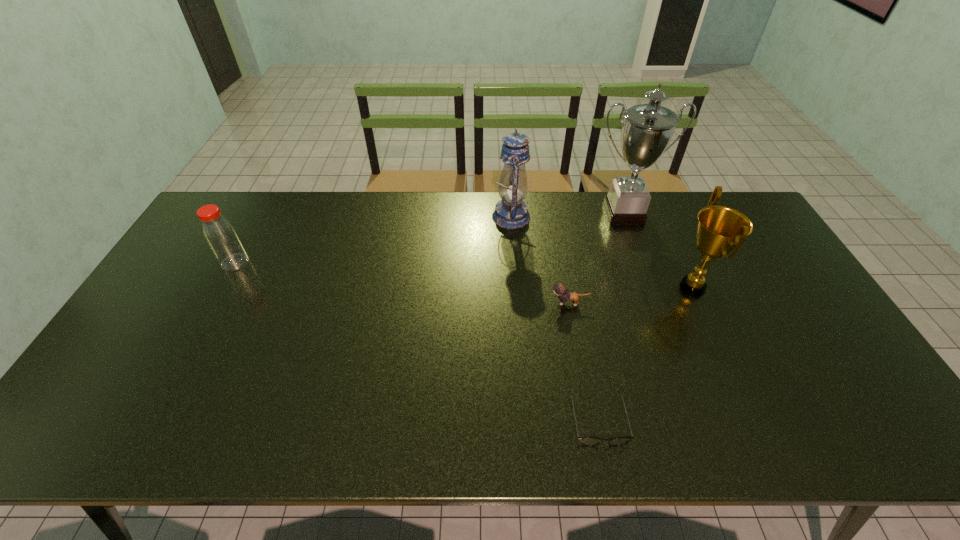
Identify the location of free space located on the front-facing side of the lantern. (464, 217).

You are a GUI agent. You are given a task and a screenshot of the screen. Output one action in this format:
    pyautogui.click(x=<x>, y=<y>)
    Task: Click on the vacant space located on the front-facing side of the lantern
    The width and height of the screenshot is (960, 540).
    Given the screenshot: What is the action you would take?
    pyautogui.click(x=467, y=217)

The image size is (960, 540). What are the coordinates of `vacant area situated 0.070m on the front view with handles of the award` in the screenshot? It's located at (646, 287).

Locate an element on the screen. The width and height of the screenshot is (960, 540). free region located on the front view with handles of the award is located at coordinates (545, 287).

Locate an element on the screen. blank space located on the front view with handles of the award is located at coordinates (616, 287).

Locate an element on the screen. vacant area located 0.240m on the right of the bottle is located at coordinates (325, 262).

Locate an element on the screen. free location located 0.340m on the front-facing side of the kitten is located at coordinates (431, 303).

What are the coordinates of `vacant region located 0.260m on the front-facing side of the kitten` in the screenshot? It's located at pyautogui.click(x=459, y=303).

Locate an element on the screen. vacant space located on the front-facing side of the kitten is located at coordinates (525, 303).

The width and height of the screenshot is (960, 540). In order to click on trophy cup located in the far edge section of the desktop in this screenshot , I will do `click(647, 129)`.